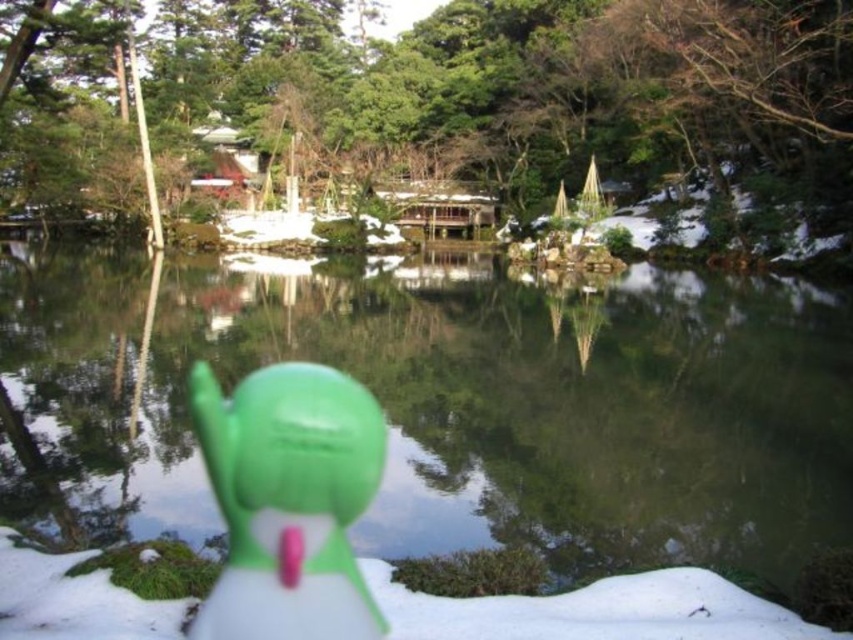
Question: Which point appears closest to the camera in this image?

Choices:
 (A) (183, 602)
 (B) (322, 500)
 (C) (616, 378)

Answer: (A)

Question: Among these objects, which one is nearest to the camera?

Choices:
 (A) green matte tree at upper center
 (B) green matte snowman at center
 (C) white fluffy snow at lower center

Answer: (B)

Question: Is green matte tree at upper center below white fluffy snow at lower center?

Choices:
 (A) yes
 (B) no

Answer: (B)

Question: Among these objects, which one is nearest to the camera?

Choices:
 (A) clear glass water at center
 (B) green matte snowman at center
 (C) green matte tree at upper center
 (D) white fluffy snow at lower center

Answer: (B)

Question: Does clear glass water at center have a lesser width compared to green matte tree at upper center?

Choices:
 (A) yes
 (B) no

Answer: (A)

Question: Does clear glass water at center have a smaller size compared to green matte snowman at center?

Choices:
 (A) yes
 (B) no

Answer: (B)